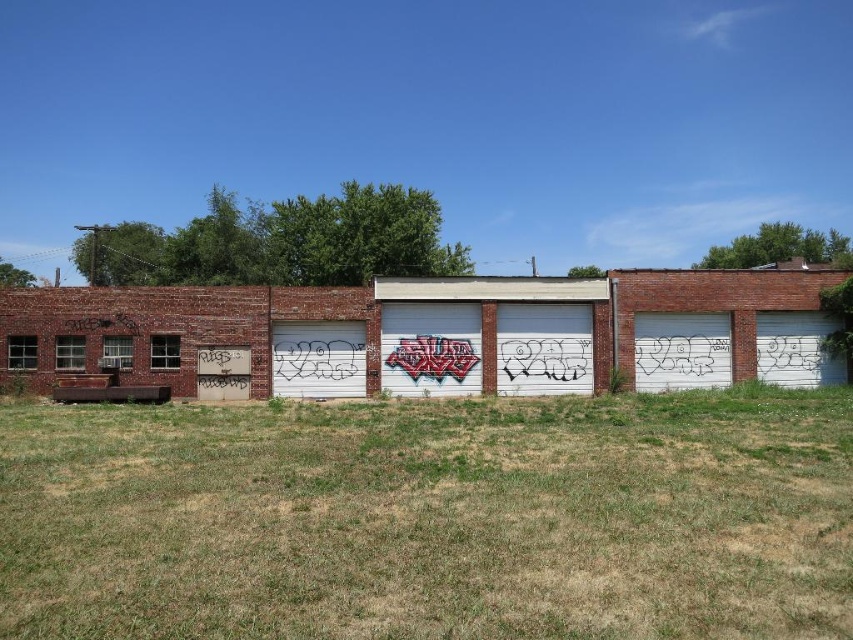
Question: Is green grass at lower center below white matte garage door at center?

Choices:
 (A) yes
 (B) no

Answer: (A)

Question: Does green grass at lower center appear on the right side of white matte garage door at center?

Choices:
 (A) yes
 (B) no

Answer: (A)

Question: Does green grass at lower center appear under white matte garage door at center?

Choices:
 (A) no
 (B) yes

Answer: (B)

Question: Among these points, which one is nearest to the camera?

Choices:
 (A) (434, 520)
 (B) (329, 323)

Answer: (A)